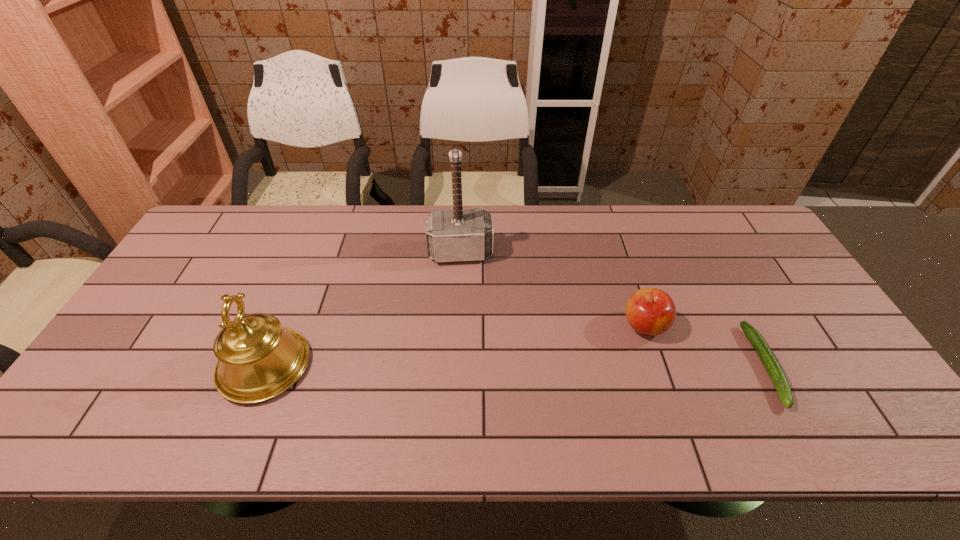
This screenshot has height=540, width=960. Identify the location of free region located 0.270m on the stem of the apple. (553, 388).

You are a GUI agent. You are given a task and a screenshot of the screen. Output one action in this format:
    pyautogui.click(x=<x>, y=<y>)
    Task: Click on the free space located 0.320m on the stem of the apple
    This screenshot has width=960, height=540.
    Given the screenshot: What is the action you would take?
    pyautogui.click(x=538, y=399)

Locate an element on the screen. free space located for striking with the head of the tallest object is located at coordinates 464,287.

This screenshot has height=540, width=960. In order to click on vacant space located 0.190m for striking with the head of the tallest object in this screenshot , I will do `click(465, 313)`.

Locate an element on the screen. This screenshot has width=960, height=540. free point located for striking with the head of the tallest object is located at coordinates (468, 365).

I want to click on object present at the far edge, so click(x=460, y=234).

The width and height of the screenshot is (960, 540). Identify the location of bell situated at the near edge. (258, 359).

Find the location of a particular element. The width and height of the screenshot is (960, 540). zucchini at the near edge is located at coordinates (766, 355).

I want to click on vacant region at the far edge, so click(389, 227).

In order to click on blank area at the near edge in this screenshot , I will do `click(317, 394)`.